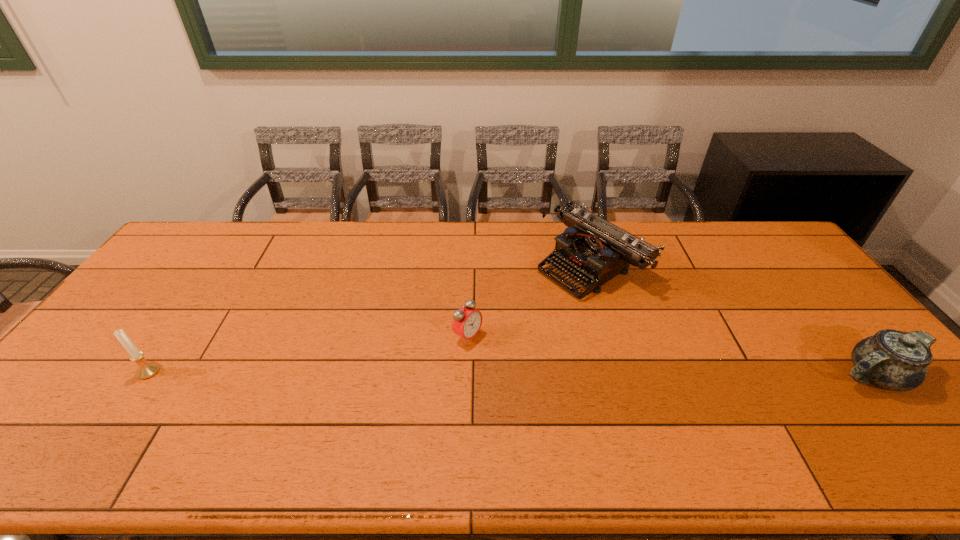
The image size is (960, 540). I want to click on vacant space at the far edge of the desktop, so click(370, 240).

Find the location of a particular element. free space at the near edge of the desktop is located at coordinates (409, 414).

Find the location of `free region at the left edge of the desktop`. free region at the left edge of the desktop is located at coordinates (190, 275).

Find the location of `vacant space at the right edge of the desktop`. vacant space at the right edge of the desktop is located at coordinates (832, 302).

In the image, there is a desktop. Find the location of `blank space at the far left corner`. blank space at the far left corner is located at coordinates (208, 225).

The width and height of the screenshot is (960, 540). In the image, there is a desktop. What are the coordinates of `vacant region at the near left corner` in the screenshot? It's located at (84, 426).

Locate an element on the screen. The height and width of the screenshot is (540, 960). vacant area that lies between the leftmost object and the chinaware is located at coordinates (x=512, y=373).

Where is `unoccupied area between the second farthest object and the rightmost object`? This screenshot has height=540, width=960. unoccupied area between the second farthest object and the rightmost object is located at coordinates point(671,356).

Identify the location of free spot between the second object from right to left and the rightmost object. This screenshot has width=960, height=540. (732, 320).

Locate an element on the screen. The image size is (960, 540). free spot between the farthest object and the shortest object is located at coordinates (529, 301).